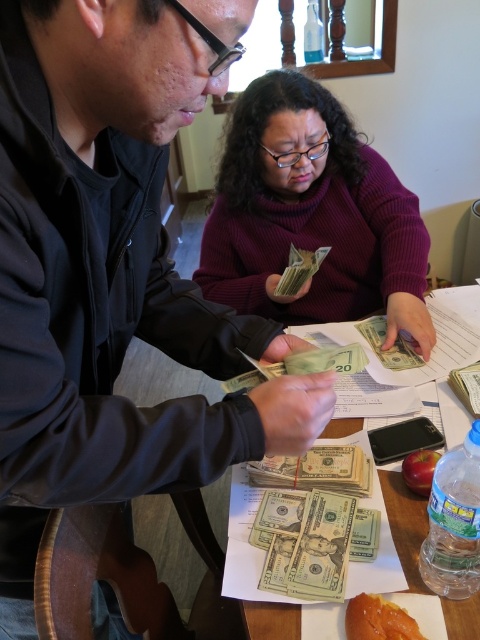
Is purple turtleneck sweater at center smaller than green paper money at center?

Correct, purple turtleneck sweater at center occupies less space than green paper money at center.

Is purple turtleneck sweater at center further to camera compared to green paper money at center?

Yes, it is behind green paper money at center.

Is point (240, 163) positioned after point (460, 305)?

Yes, it is.

Image resolution: width=480 pixels, height=640 pixels. In order to click on purple turtleneck sweater at center in this screenshot , I will do `click(312, 216)`.

From the picture: Can you confirm if matte black jacket at upper left is wider than green paper money at center?

In fact, matte black jacket at upper left might be narrower than green paper money at center.

Is point (285, 419) more distant than point (456, 428)?

No, (285, 419) is closer to viewer.

Image resolution: width=480 pixels, height=640 pixels. Identify the location of matte black jacket at upper left. (113, 273).

The height and width of the screenshot is (640, 480). I want to click on matte black jacket at upper left, so click(x=113, y=273).

Is purple turtleneck sweater at center positioned before yellow matte apple at lower center?

No.

Does purple turtleneck sweater at center have a larger size compared to yellow matte apple at lower center?

Correct, purple turtleneck sweater at center is larger in size than yellow matte apple at lower center.

The width and height of the screenshot is (480, 640). Identify the location of purple turtleneck sweater at center. (312, 216).